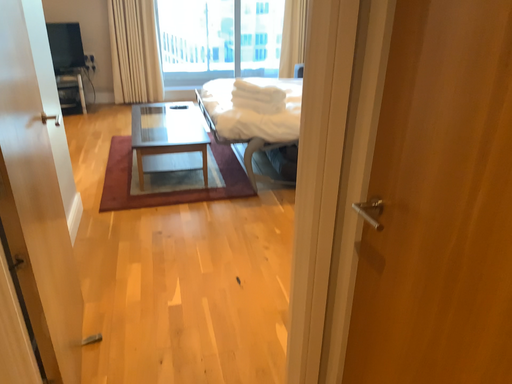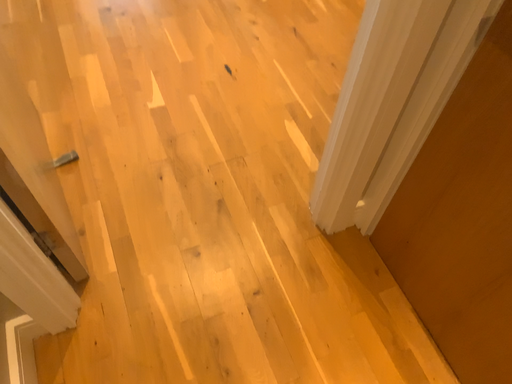
Question: How did the camera likely rotate when shooting the video?

Choices:
 (A) rotated upward
 (B) rotated downward

Answer: (B)